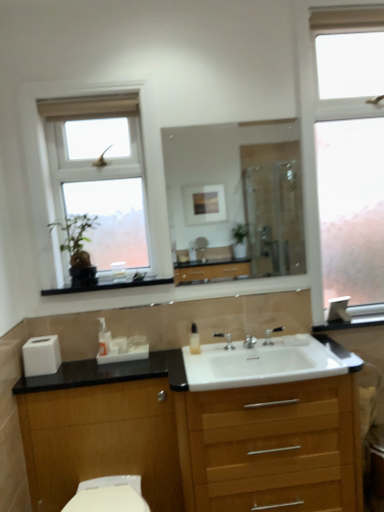
You are a GUI agent. You are given a task and a screenshot of the screen. Output one action in this format:
    pyautogui.click(x=<x>, y=<y>)
    Task: Click on the free spot in front of silver metallic tap at center, marked as the 1th tap in a left-to-right arrangement
    
    Given the screenshot: What is the action you would take?
    pyautogui.click(x=215, y=362)